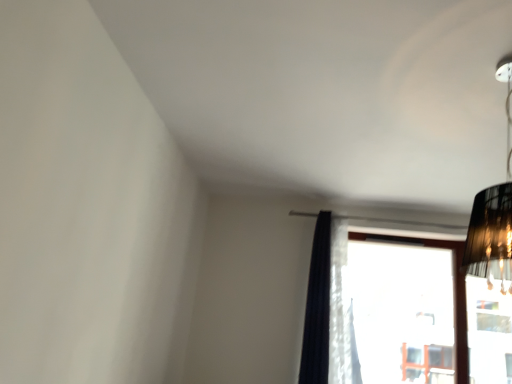
Question: Does black fabric lampshade at upper right have a smaller size compared to dark blue sheer curtain at center?

Choices:
 (A) yes
 (B) no

Answer: (B)

Question: From the image's perspective, is black fabric lampshade at upper right under dark blue sheer curtain at center?

Choices:
 (A) no
 (B) yes

Answer: (A)

Question: Is black fabric lampshade at upper right looking in the opposite direction of dark blue sheer curtain at center?

Choices:
 (A) no
 (B) yes

Answer: (A)

Question: Does black fabric lampshade at upper right turn towards dark blue sheer curtain at center?

Choices:
 (A) yes
 (B) no

Answer: (B)

Question: From a real-world perspective, is black fabric lampshade at upper right on dark blue sheer curtain at center?

Choices:
 (A) no
 (B) yes

Answer: (B)

Question: Considering the relative positions of black fabric lampshade at upper right and dark blue sheer curtain at center in the image provided, is black fabric lampshade at upper right to the left of dark blue sheer curtain at center from the viewer's perspective?

Choices:
 (A) yes
 (B) no

Answer: (B)

Question: From the image's perspective, is black fabric lampshade at upper right on transparent glass window at center?

Choices:
 (A) no
 (B) yes

Answer: (B)

Question: Considering the relative sizes of black fabric lampshade at upper right and transparent glass window at center in the image provided, is black fabric lampshade at upper right bigger than transparent glass window at center?

Choices:
 (A) no
 (B) yes

Answer: (A)

Question: Is black fabric lampshade at upper right taller than transparent glass window at center?

Choices:
 (A) no
 (B) yes

Answer: (A)

Question: Is transparent glass window at center completely or partially inside black fabric lampshade at upper right?

Choices:
 (A) no
 (B) yes

Answer: (A)

Question: Could you tell me if black fabric lampshade at upper right is facing transparent glass window at center?

Choices:
 (A) yes
 (B) no

Answer: (B)

Question: Does black fabric lampshade at upper right have a lesser height compared to transparent glass window at center?

Choices:
 (A) yes
 (B) no

Answer: (A)

Question: Considering the relative positions of dark blue sheer curtain at center and transparent glass window at center in the image provided, is dark blue sheer curtain at center in front of transparent glass window at center?

Choices:
 (A) yes
 (B) no

Answer: (A)